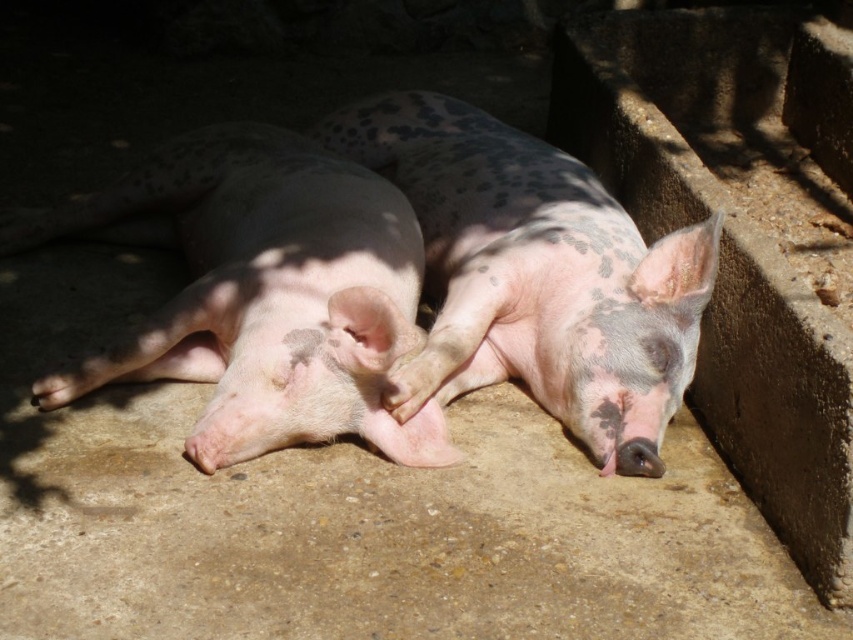
You are standing at the origin point of the coordinate system. A pink matte pig at center is located at point (x=264, y=292). Can you determine if the pink matte pig at center is closer to the origin than the point 0.5, 0.3?

The pink matte pig at center is located at point (x=264, y=292). The distance from the origin to this point is sqrt0.459 squared plus 0.311 squared, which is approximately 0.553. The distance to the point 0.5, 0.3 is sqrt0.5 squared plus 0.3 squared, which is approximately 0.583. Since 0.553 is less than 0.583, the pink matte pig at center is closer to the origin than the point 0.5, 0.3.

You are standing at the origin point in the image. Where is the pink matte pig at center located in terms of coordinates?

The pink matte pig at center is located at coordinates 0.459 on the x axis and 0.311 on the y axis.